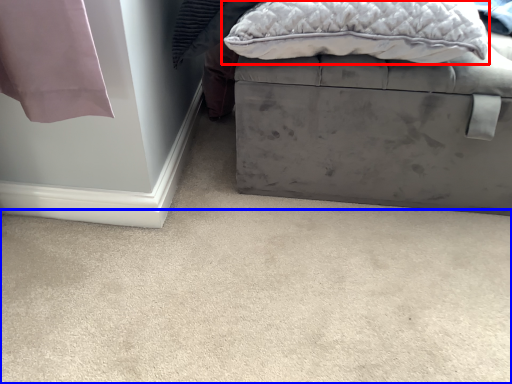
Question: Which object appears farthest to the camera in this image, pillow (highlighted by a red box) or concrete (highlighted by a blue box)?

Choices:
 (A) pillow
 (B) concrete

Answer: (A)